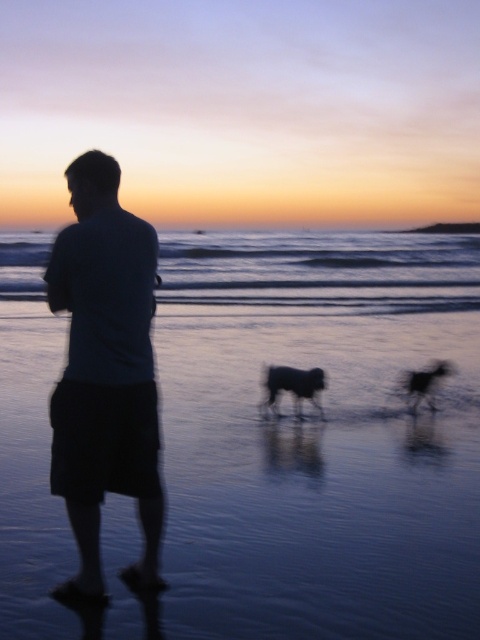
Does dark blue shirt at center lie behind black furry dog at center?

No, it is not.

Where is `dark blue shirt at center`? This screenshot has width=480, height=640. dark blue shirt at center is located at coordinates (105, 372).

Identify the location of dark blue shirt at center. The image size is (480, 640). (105, 372).

Does smooth sand at lower center appear under silky black dog at center?

Actually, smooth sand at lower center is above silky black dog at center.

Which is behind, point (291, 269) or point (414, 388)?

Positioned behind is point (291, 269).

Is point (358, 278) more distant than point (439, 372)?

Yes, point (358, 278) is behind point (439, 372).

Where is `smooth sand at lower center`? smooth sand at lower center is located at coordinates (323, 269).

Does point (104, 282) lie in front of point (420, 390)?

Yes, it is.

You are a GUI agent. You are given a task and a screenshot of the screen. Output one action in this format:
    pyautogui.click(x=<x>, y=<y>)
    Task: Click on the dark blue shirt at center
    
    Given the screenshot: What is the action you would take?
    pyautogui.click(x=105, y=372)